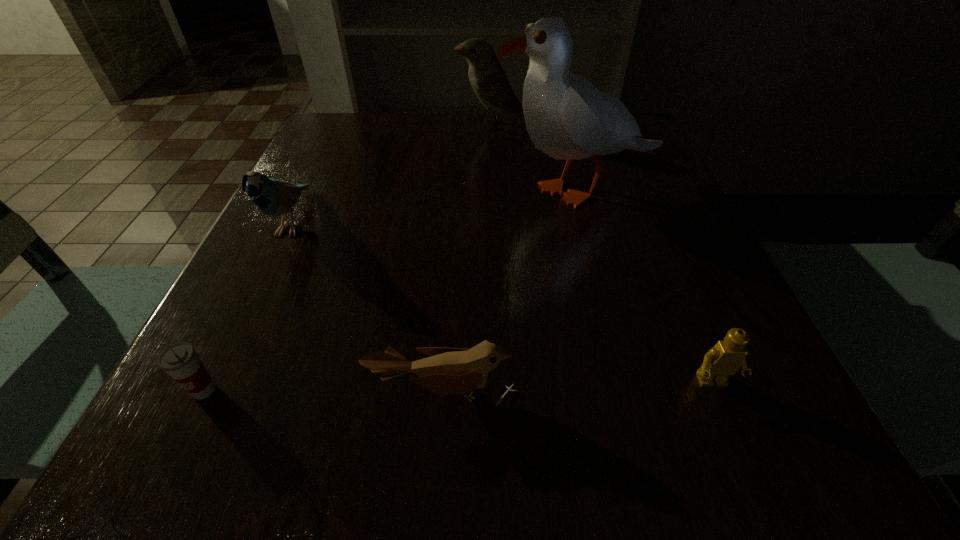
This screenshot has height=540, width=960. Identify the location of unoccupied position between the second tallest bird and the tallest object. (436, 206).

Locate an element on the screen. vacant space that's between the cup and the gull is located at coordinates (392, 291).

The width and height of the screenshot is (960, 540). Find the location of `free space between the shortest bird and the tallest object`. free space between the shortest bird and the tallest object is located at coordinates (512, 292).

Identify the location of vacant point located between the farthest object and the Lego. (602, 254).

The width and height of the screenshot is (960, 540). What are the coordinates of `unoccupied area between the second shortest bird and the tallest object` in the screenshot? It's located at (436, 206).

The image size is (960, 540). In order to click on unoccupied area between the Lego and the farthest bird in this screenshot , I will do `click(602, 254)`.

Locate an element on the screen. This screenshot has height=540, width=960. unoccupied area between the farthest bird and the tallest object is located at coordinates (536, 158).

Identify which object is located as the fourth nearest to the second tallest object. Please provide its 2D coordinates. Your answer should be formatted as a tuple, i.e. [(x, y)], where the tuple contains the x and y coordinates of a point satisfying the conditions above.

[(729, 356)]

Select which object is the fourth closest to the gull. Please provide its 2D coordinates. Your answer should be formatted as a tuple, i.e. [(x, y)], where the tuple contains the x and y coordinates of a point satisfying the conditions above.

[(273, 197)]

The width and height of the screenshot is (960, 540). I want to click on bird that is the nearest to the cup, so click(449, 371).